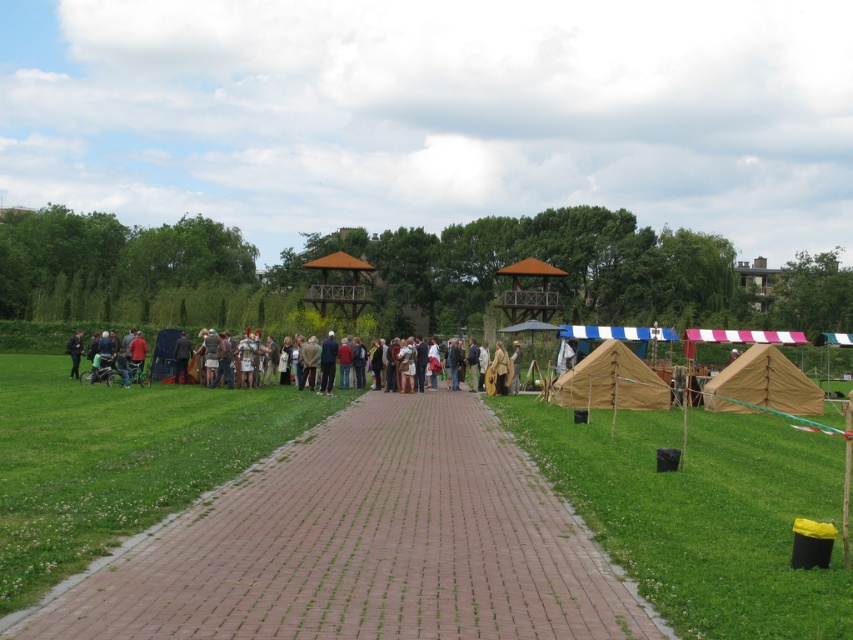
Based on the photo, you are standing at the center of the paved brick pathway in the park. You want to place a new bench exactly halfway between the tan canvas tent at right and the red and white striped barrier. Where should you place the bench?

The tan canvas tent at right is located at point (763, 385). The red and white striped barrier is positioned in front of the tents. To place the bench halfway between them, calculate the midpoint between these two coordinates. However, since the exact coordinate of the barrier isn